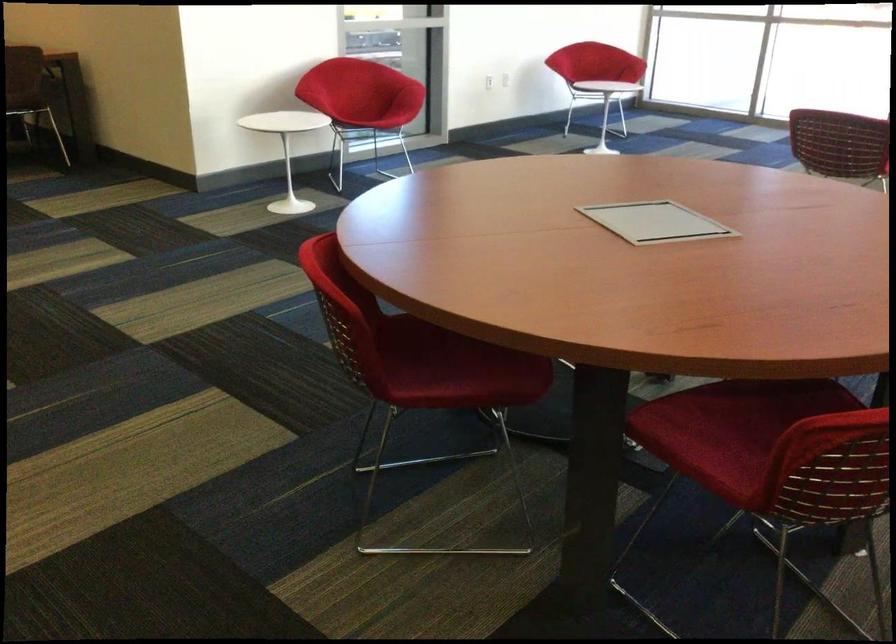
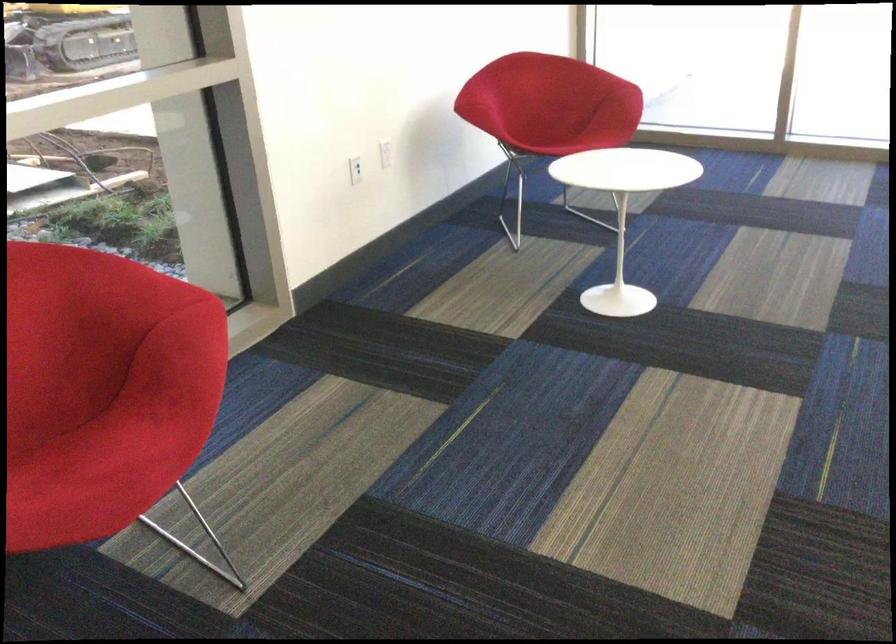
Where in the second image is the point corresponding to (x=381, y=124) from the first image?

(115, 450)